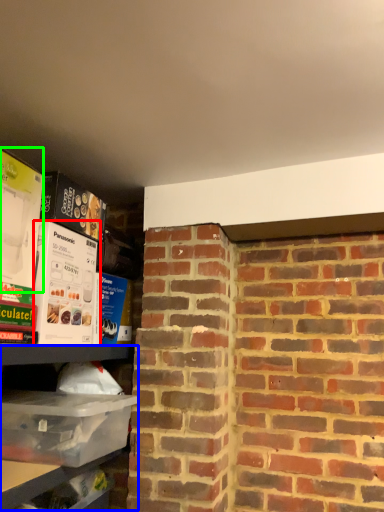
Question: Based on their relative distances, which object is nearer to box (highlighted by a red box)? Choose from shelf (highlighted by a blue box) and box (highlighted by a green box).

Choices:
 (A) shelf
 (B) box

Answer: (B)